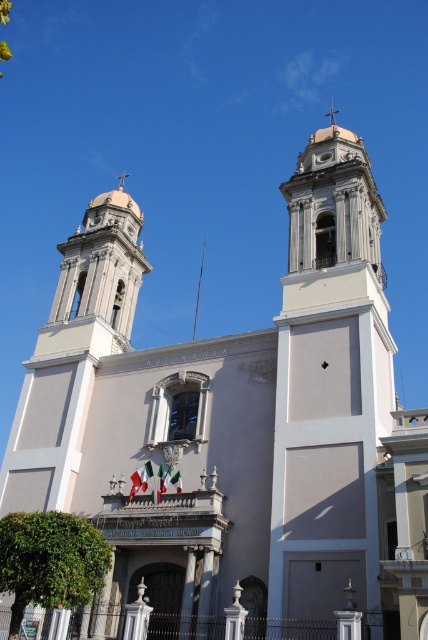
Question: Which point is closer to the camera?

Choices:
 (A) (133, 218)
 (B) (356, 360)

Answer: (B)

Question: Does white marble bell tower at upper center have a greater width compared to matte white bell tower at upper left?

Choices:
 (A) no
 (B) yes

Answer: (A)

Question: Can you confirm if white marble bell tower at upper center is bigger than matte white bell tower at upper left?

Choices:
 (A) no
 (B) yes

Answer: (A)

Question: From the image, what is the correct spatial relationship of white marble bell tower at upper center in relation to matte white bell tower at upper left?

Choices:
 (A) right
 (B) left

Answer: (A)

Question: Which object is closer to the camera taking this photo?

Choices:
 (A) white marble bell tower at upper center
 (B) matte white bell tower at upper left

Answer: (A)